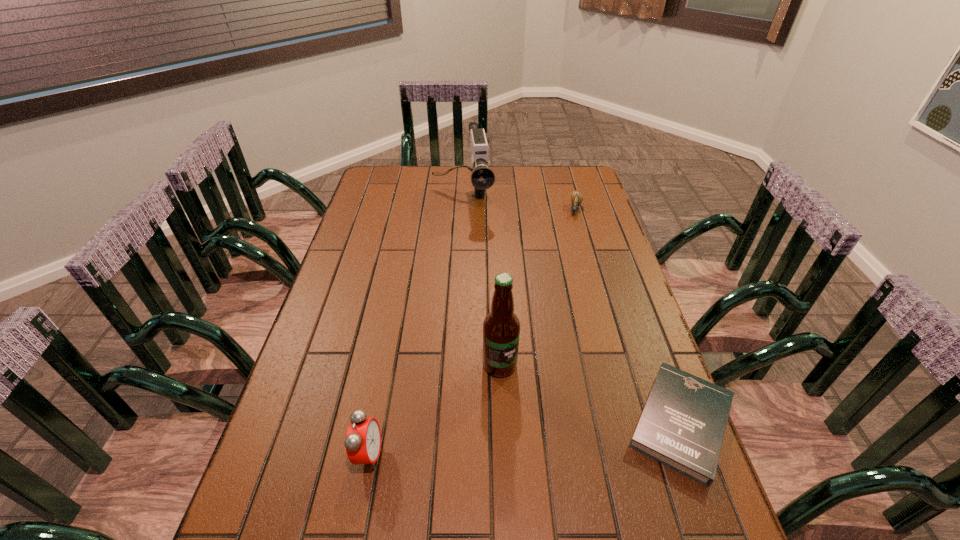
Locate an element on the screen. Image resolution: width=960 pixels, height=540 pixels. alarm clock is located at coordinates (363, 439).

You are a GUI agent. You are given a task and a screenshot of the screen. Output one action in this format:
    pyautogui.click(x=<x>, y=<y>)
    Task: Click on the leftmost object
    The height and width of the screenshot is (540, 960).
    Given the screenshot: What is the action you would take?
    pyautogui.click(x=363, y=439)

The height and width of the screenshot is (540, 960). Find the location of `book`. book is located at coordinates (683, 423).

This screenshot has width=960, height=540. I want to click on the second tallest object, so click(482, 178).

Where is `beer bottle`? beer bottle is located at coordinates (501, 328).

In order to click on the second shortest object in this screenshot , I will do `click(576, 197)`.

The height and width of the screenshot is (540, 960). I want to click on vacant space located on the front-facing side of the leftmost object, so click(409, 455).

In order to click on free point located 0.100m on the back of the shortest object in this screenshot , I will do `click(651, 339)`.

You are a GUI agent. You are given a task and a screenshot of the screen. Output one action in this format:
    pyautogui.click(x=<x>, y=<y>)
    Task: Click on the vacant region located on the recording direction of the second tallest object
    This screenshot has height=540, width=960.
    Given the screenshot: What is the action you would take?
    click(468, 258)

The image size is (960, 540). I want to click on blank space located on the recording direction of the second tallest object, so click(466, 230).